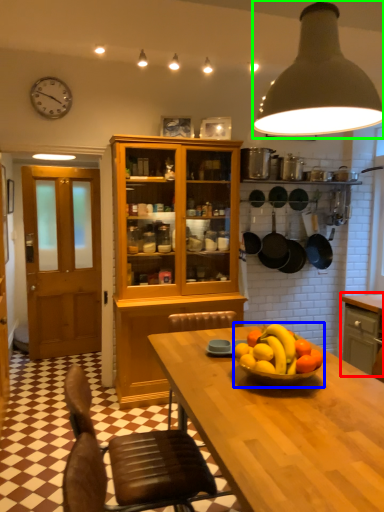
Question: Based on their relative distances, which object is nearer to cabinetry (highlighted by a red box)? Choose from fruit dish (highlighted by a blue box) and light (highlighted by a green box).

Choices:
 (A) fruit dish
 (B) light

Answer: (A)